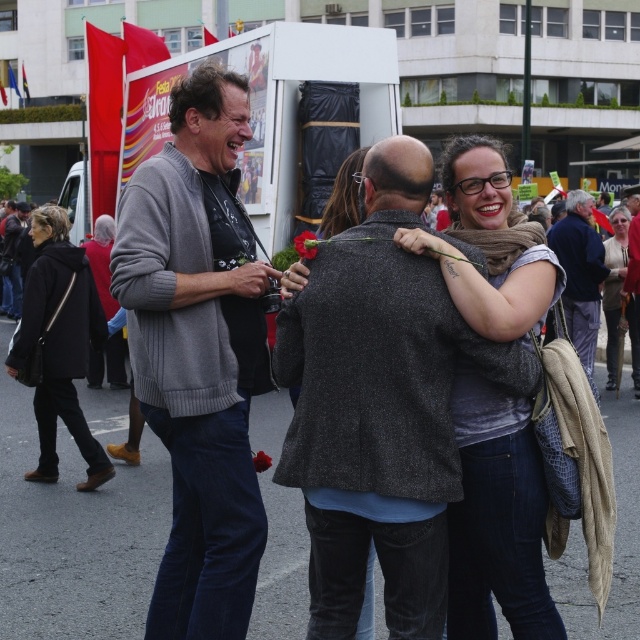
Does gray knitted sweater at left appear on the left side of dark blue coat at left?

In fact, gray knitted sweater at left is to the right of dark blue coat at left.

From the picture: Does gray knitted sweater at left lie behind dark blue coat at left?

No, it is not.

Who is more forward, (147, 180) or (36, 336)?

Positioned in front is point (147, 180).

Where is `gray knitted sweater at left`? The width and height of the screenshot is (640, 640). gray knitted sweater at left is located at coordinates (198, 353).

Is light beige scarf at center bigger than dark gray textured jacket at center?

Incorrect, light beige scarf at center is not larger than dark gray textured jacket at center.

Is light beige scarf at center smaller than dark gray textured jacket at center?

Yes.

Identify the location of light beige scarf at center. Image resolution: width=640 pixels, height=640 pixels. (618, 298).

Locate an element on the screen. Image resolution: width=640 pixels, height=640 pixels. light beige scarf at center is located at coordinates (618, 298).

Does point (616, 385) come closer to viewer compared to point (294, 240)?

Yes, it is.

Measure the distance between light beige scarf at center and camera.

light beige scarf at center and camera are 10.75 meters apart from each other.

Identify the location of light beige scarf at center. (618, 298).